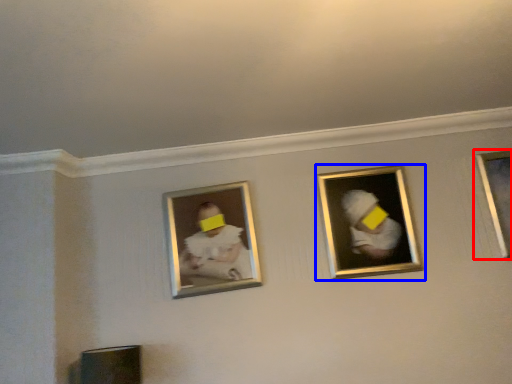
Question: Which of the following is the closest to the observer, picture frame (highlighted by a red box) or picture frame (highlighted by a blue box)?

Choices:
 (A) picture frame
 (B) picture frame

Answer: (B)